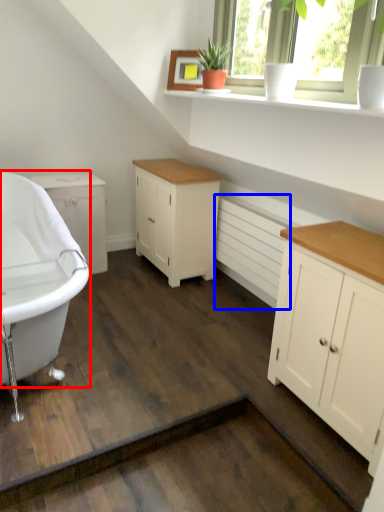
Question: Which object is further to the camera taking this photo, bathtub (highlighted by a red box) or radiator (highlighted by a blue box)?

Choices:
 (A) bathtub
 (B) radiator

Answer: (B)